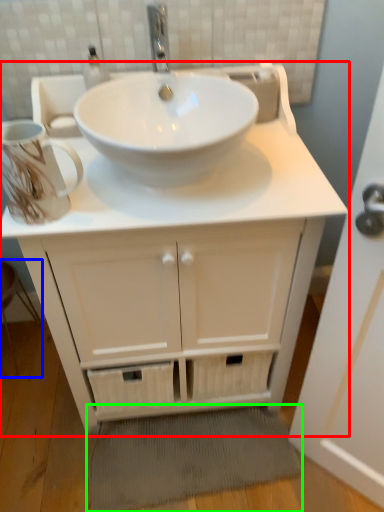
Question: Which object is the farthest from bathroom cabinet (highlighted by a red box)? Choose among these: step stool (highlighted by a blue box) or bath mat (highlighted by a green box).

Choices:
 (A) step stool
 (B) bath mat

Answer: (A)